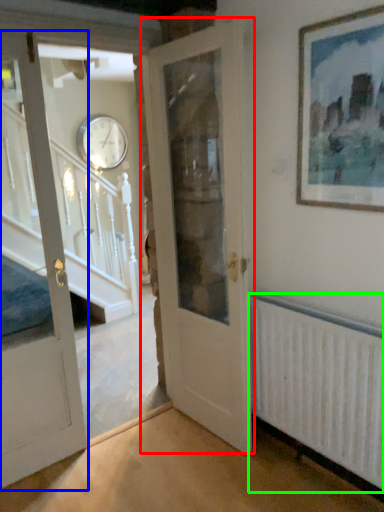
Question: Which object is positioned farthest from door (highlighted by a red box)? Select from door (highlighted by a blue box) and radiator (highlighted by a green box).

Choices:
 (A) door
 (B) radiator

Answer: (A)